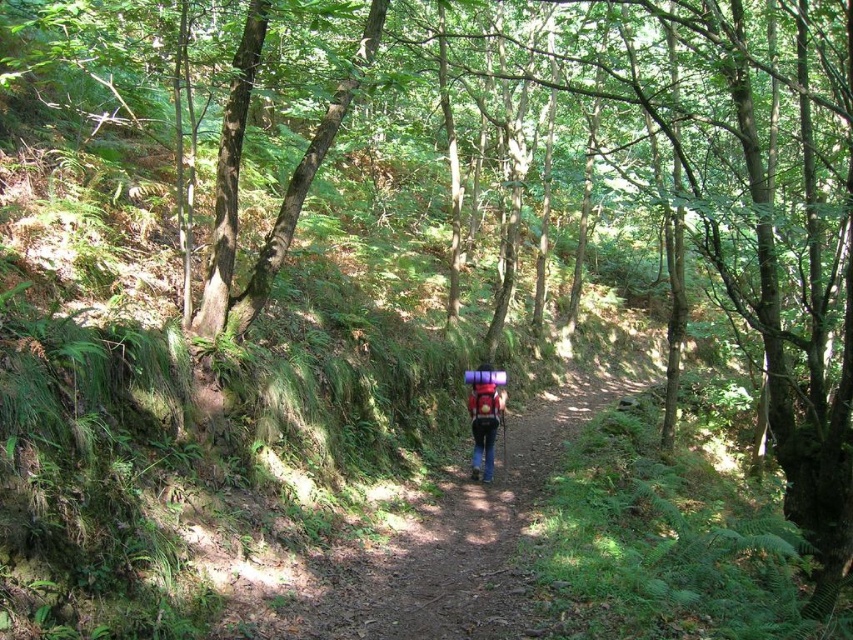
Consider the image. You are a hiker who wants to place your matte pink backpack at center on the ground without blocking the brown dirt path at center. Given that the backpack requires 2 feet of space in all directions, is there enough space between the backpack and the path?

The brown dirt path at center is 8.08 feet away from matte pink backpack at center. Since the backpack needs 2 feet of space around it, the distance between them is sufficient as 8.08 feet is greater than 2 feet.

You are a hiker navigating a narrow dirt path in a dense forest. You notice two points marked on the path ahead of you. The first point is at coordinates point [506,554], and the second is at point [486,397]. Which of these two points is closer to your current position?

Point [506,554] is closer to the camera than point [486,397], so the first point is closer to your current position.

You are a hiker trying to follow the narrow dirt path in the forest. According to the map, the path is marked at coordinates 0.822, 0.540. Can you confirm if the brown dirt path at center is indeed located at those coordinates?

Yes, the brown dirt path at center is located at point (x=460, y=525), so it matches the coordinates on the map.